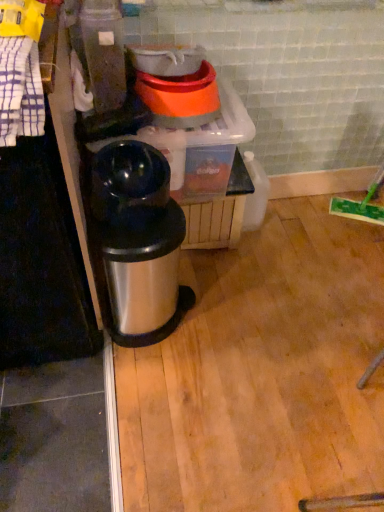
Question: From a real-world perspective, relative to shiny metallic trash can at center, is shiny black thermos at center, the first appliance positioned from the bottom, vertically above or below?

Choices:
 (A) below
 (B) above

Answer: (B)

Question: In the image, is shiny black thermos at center, the second appliance in the top-to-bottom sequence, positioned in front of or behind shiny metallic trash can at center?

Choices:
 (A) front
 (B) behind

Answer: (A)

Question: Which object is the farthest from the white checkered towel at left?

Choices:
 (A) shiny black thermos at center, the first appliance positioned from the bottom
 (B) shiny metallic trash can at center
 (C) orange plastic bowls at upper center, placed as the 2th appliance when sorted from bottom to top

Answer: (C)

Question: Which object is positioned closest to the white checkered towel at left?

Choices:
 (A) orange plastic bowls at upper center, placed as the 2th appliance when sorted from bottom to top
 (B) shiny black thermos at center, the second appliance in the top-to-bottom sequence
 (C) shiny metallic trash can at center

Answer: (B)